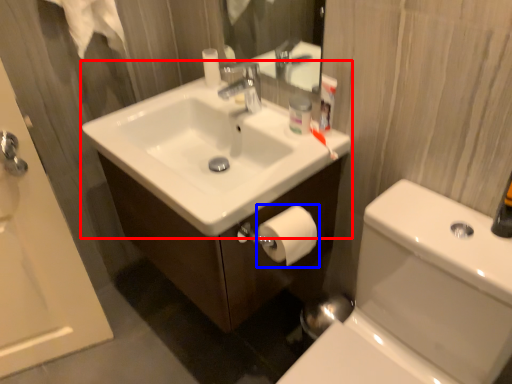
Question: Which object appears farthest to the camera in this image, sink (highlighted by a red box) or toilet paper (highlighted by a blue box)?

Choices:
 (A) sink
 (B) toilet paper

Answer: (B)